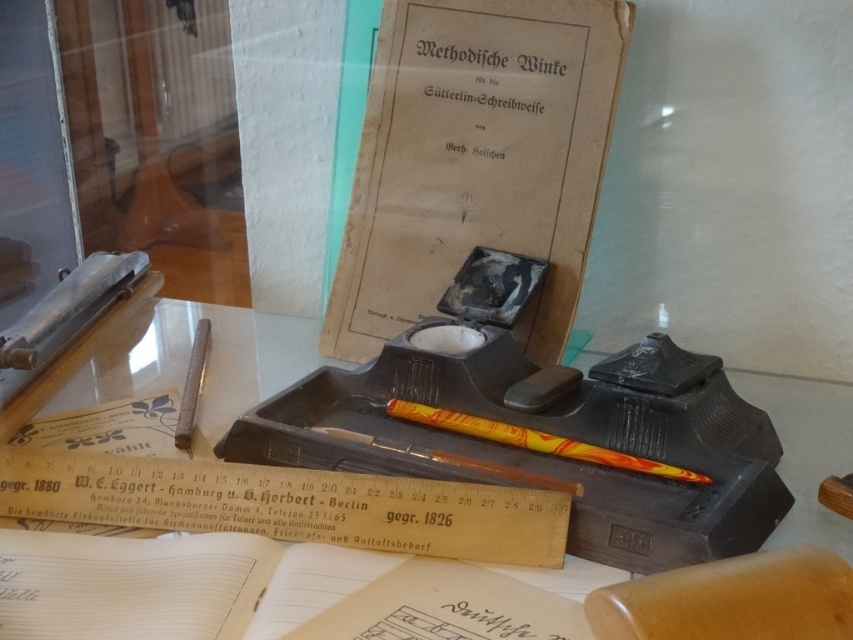
You are a curator arranging items in a display case. You need to place a new item at coordinates that are exactly 0.1 units to the right of the wooden ruler at lower center. What are the coordinates where you should place the new item?

The wooden ruler at lower center is located at point (288, 504). Adding 0.1 to the x coordinate gives 0.889, so the new coordinates are (288, 568).